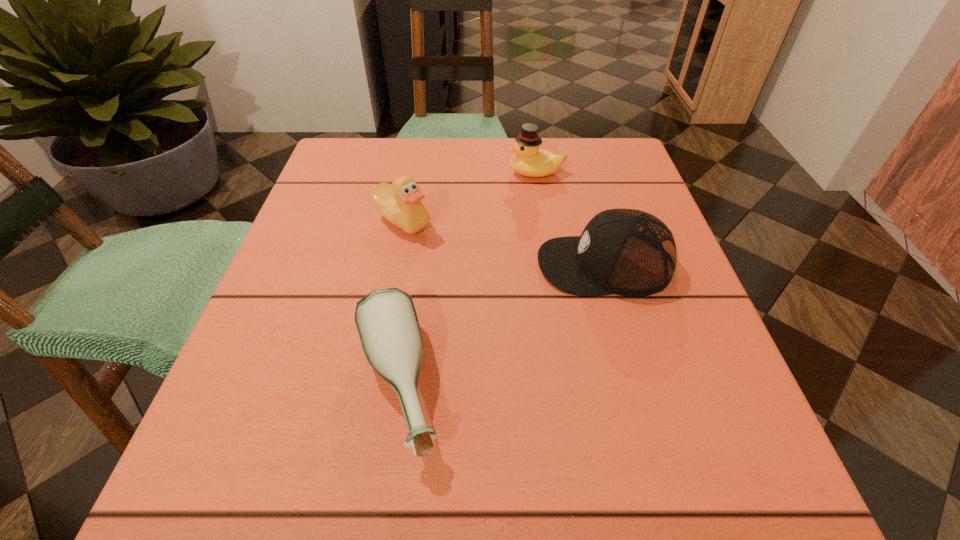
In the image, there is a desktop. Identify the location of vacant space at the left edge. This screenshot has width=960, height=540. (215, 415).

Where is `vacant region at the right edge`? The image size is (960, 540). vacant region at the right edge is located at coordinates (625, 388).

This screenshot has width=960, height=540. I want to click on vacant region at the far left corner, so click(358, 164).

I want to click on free space at the near left corner, so click(x=276, y=459).

At what (x,y) coordinates should I click in order to perform the action: click on vacant space at the far right corner. Please return your answer as a coordinate pair (x, y). Looking at the image, I should click on (625, 180).

Where is `vacant region between the cap and the left duck`? vacant region between the cap and the left duck is located at coordinates (503, 242).

The width and height of the screenshot is (960, 540). Identify the location of unoccupied area between the nearer duck and the farthest object. (468, 197).

Where is `vacant space that's between the cap and the nearer duck`? vacant space that's between the cap and the nearer duck is located at coordinates (503, 242).

Identify the location of vacant point located between the cap and the nearer duck. (503, 242).

The image size is (960, 540). What are the coordinates of `empty space between the nearer duck and the farthest object` in the screenshot? It's located at (468, 197).